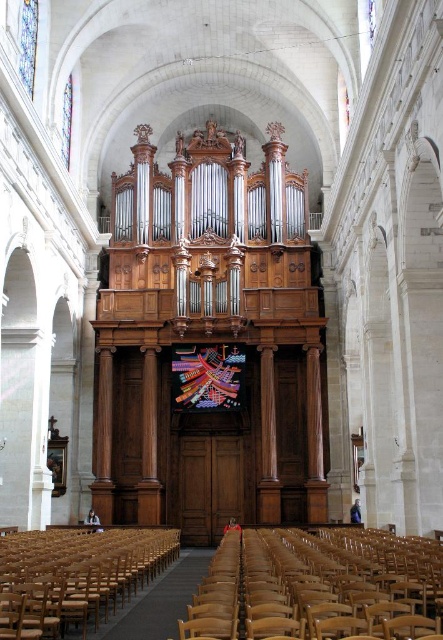
Which is more to the left, light brown wooden chair at lower center or wooden chair at lower left?

wooden chair at lower left

Locate an element on the screen. The height and width of the screenshot is (640, 443). light brown wooden chair at lower center is located at coordinates (318, 586).